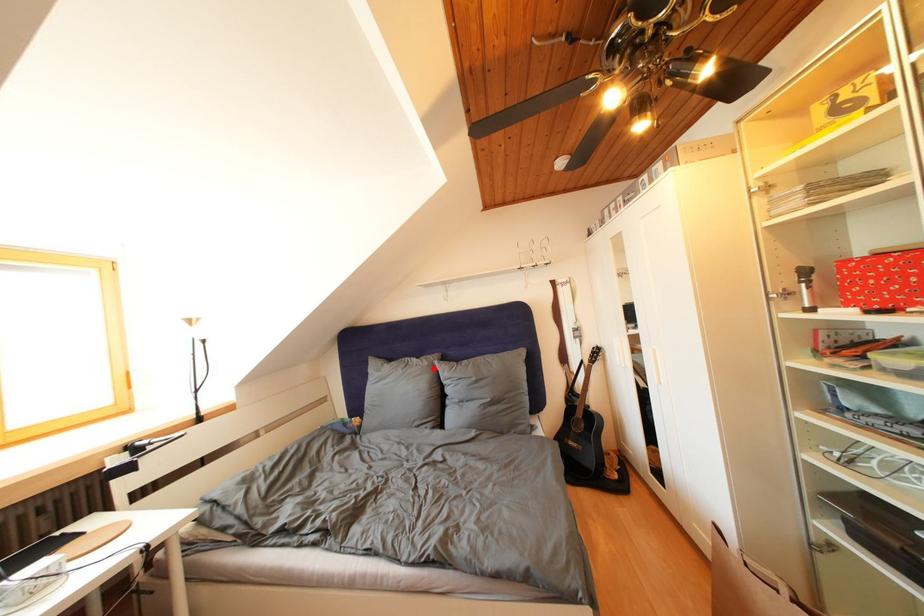
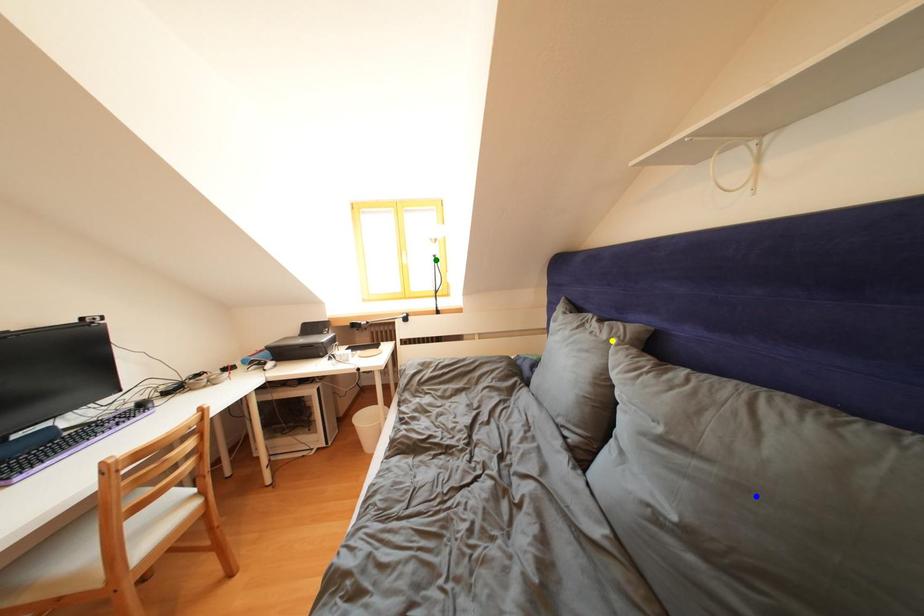
Question: I am providing you with two images of the same scene from different viewpoints. A red point is marked on the first image. You are given multiple points on the second image. Which point in image 2 is actually the same real-world point as the red point in image 1?

Choices:
 (A) yellow point
 (B) blue point
 (C) green point

Answer: (A)